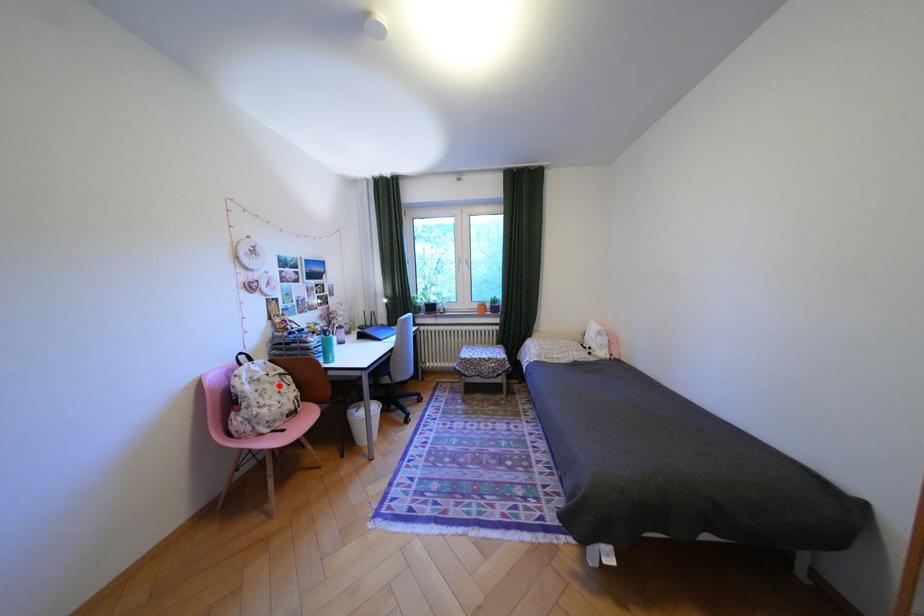
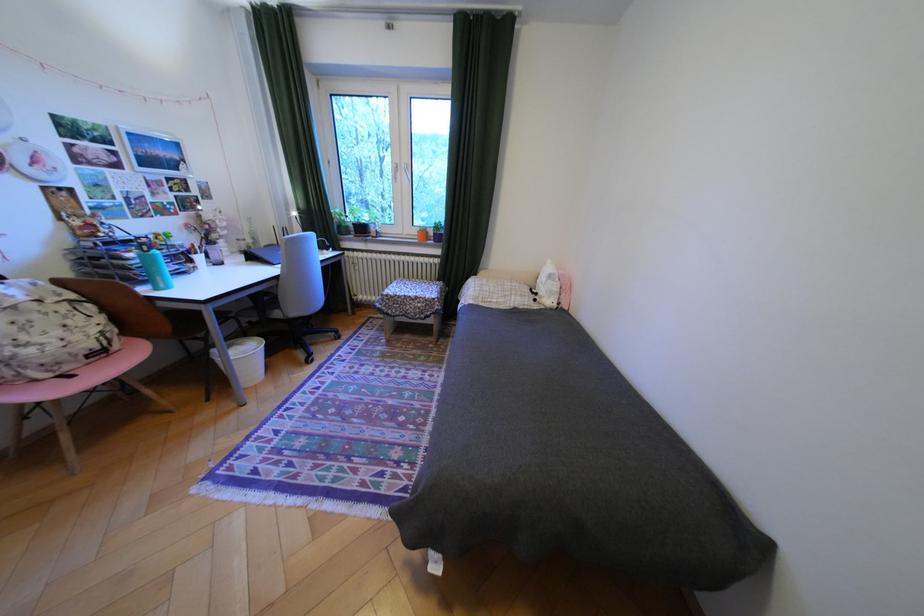
Locate, in the second image, the point that corresponds to the highlighted location in the first image.

(49, 317)